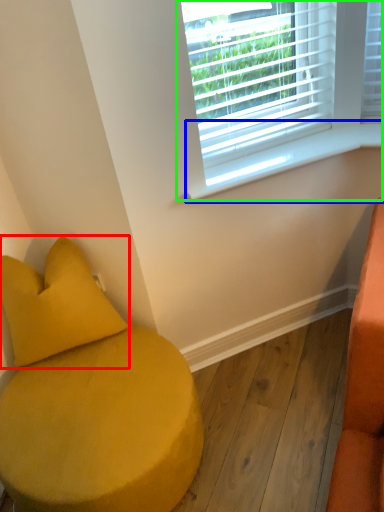
Question: Which is farther away from pillow (highlighted by a red box)? window sill (highlighted by a blue box) or window (highlighted by a green box)?

Choices:
 (A) window sill
 (B) window

Answer: (B)